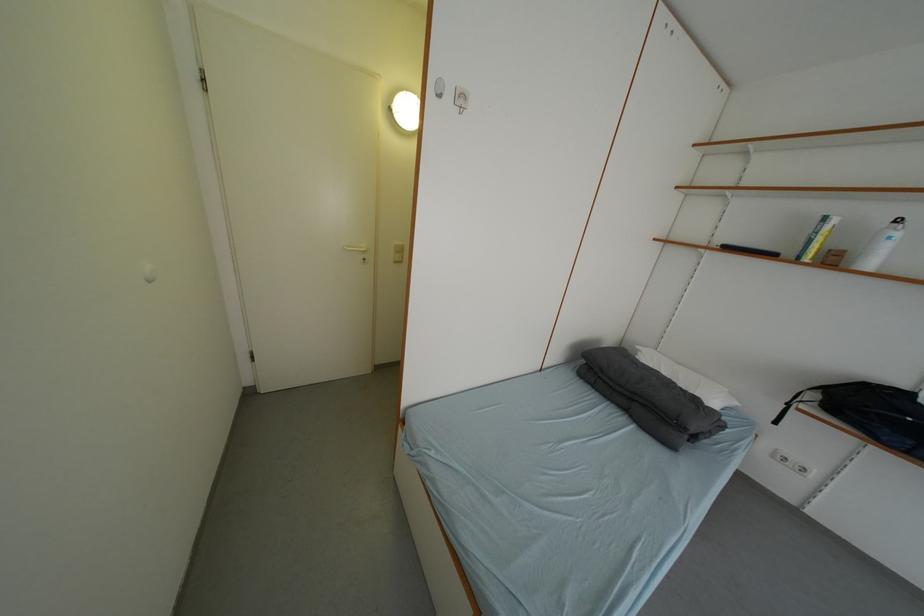
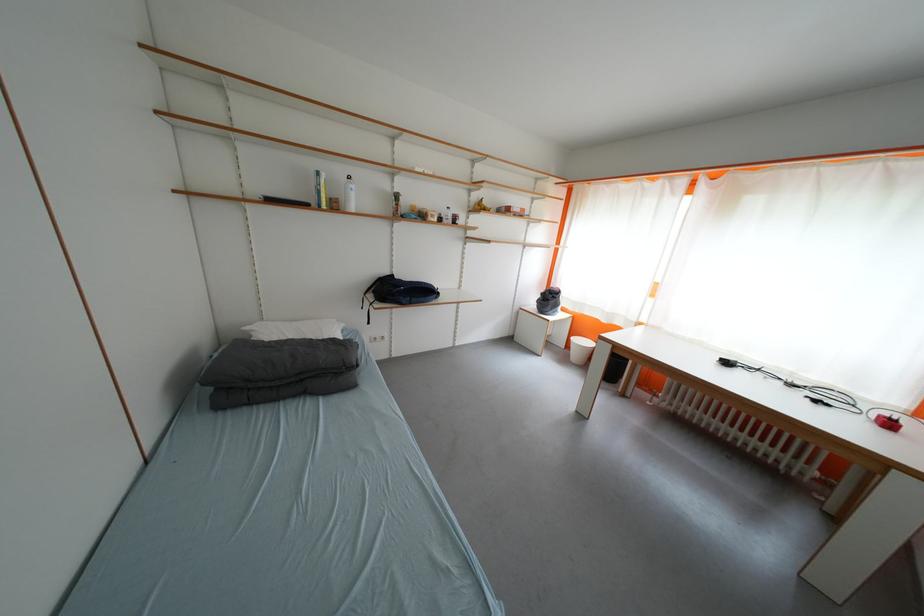
The point at (x=648, y=351) is marked in the first image. Where is the corresponding point in the second image?

(257, 331)